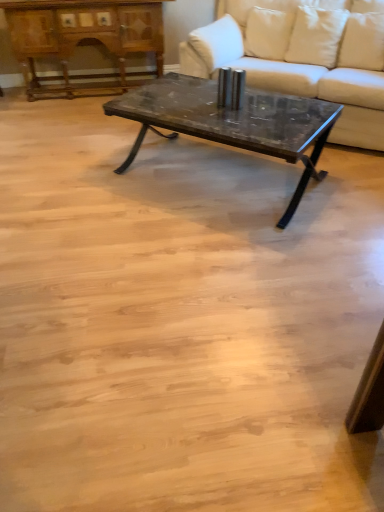
Measure the distance between white fabric pillow at upper right, the first pillow when ordered from left to right, and camera.

The depth of white fabric pillow at upper right, the first pillow when ordered from left to right, is 3.03 meters.

In order to face white fabric pillow at upper center, which is the first pillow in right-to-left order, should I rotate leftwards or rightwards?

It's best to rotate right around 10.186 degrees.

At what (x,y) coordinates should I click in order to perform the action: click on dark gray stone coffee table at center. Please return your answer as a coordinate pair (x, y). Image resolution: width=384 pixels, height=512 pixels. Looking at the image, I should click on (232, 122).

Where is `white fabric pillow at upper right, marked as the second pillow in a right-to-left arrangement`? Image resolution: width=384 pixels, height=512 pixels. white fabric pillow at upper right, marked as the second pillow in a right-to-left arrangement is located at coordinates (218, 42).

What's the angular difference between dark gray stone coffee table at center and white fabric couch at center's facing directions?

4.72 degrees.

Is dark gray stone coffee table at center thinner than white fabric couch at center?

Yes, dark gray stone coffee table at center is thinner than white fabric couch at center.

Between dark gray stone coffee table at center and white fabric couch at center, which one appears on the right side from the viewer's perspective?

white fabric couch at center is more to the right.

Which point is more forward, (326, 117) or (253, 11)?

Point (326, 117)

Is dark gray stone coffee table at center facing away from wooden polished dresser at upper left?

No, dark gray stone coffee table at center is not facing away from wooden polished dresser at upper left.

Can you tell me how much dark gray stone coffee table at center and wooden polished dresser at upper left differ in facing direction?

The facing directions of dark gray stone coffee table at center and wooden polished dresser at upper left are 40.7 degrees apart.

Between dark gray stone coffee table at center and wooden polished dresser at upper left, which one appears on the right side from the viewer's perspective?

dark gray stone coffee table at center is more to the right.

Considering the sizes of objects dark gray stone coffee table at center and wooden polished dresser at upper left in the image provided, who is wider, dark gray stone coffee table at center or wooden polished dresser at upper left?

With larger width is dark gray stone coffee table at center.

Find the location of a particular element. This screenshot has width=384, height=512. studio couch in front of the white fabric pillow at upper right, marked as the second pillow in a right-to-left arrangement is located at coordinates (301, 59).

In the scene shown: From a real-world perspective, does white fabric pillow at upper right, the first pillow when ordered from left to right, stand above white fabric couch at center?

Yes, from a real-world perspective, white fabric pillow at upper right, the first pillow when ordered from left to right, is over white fabric couch at center

Is white fabric couch at center to the right of white fabric pillow at upper right, marked as the second pillow in a right-to-left arrangement, from the viewer's perspective?

Yes.

Between white fabric couch at center and white fabric pillow at upper right, the first pillow when ordered from left to right, which one is positioned behind?

Positioned behind is white fabric pillow at upper right, the first pillow when ordered from left to right.

Measure the distance from white fabric couch at center to white fabric pillow at upper right, the first pillow when ordered from left to right.

white fabric couch at center is 12.93 inches from white fabric pillow at upper right, the first pillow when ordered from left to right.

Considering the sizes of white fabric couch at center and white fabric pillow at upper right, marked as the second pillow in a right-to-left arrangement, in the image, is white fabric couch at center taller or shorter than white fabric pillow at upper right, marked as the second pillow in a right-to-left arrangement,?

Clearly, white fabric couch at center is taller compared to white fabric pillow at upper right, marked as the second pillow in a right-to-left arrangement.

From the image's perspective, is white fabric pillow at upper center, which is the first pillow in right-to-left order, on white fabric pillow at upper right, marked as the second pillow in a right-to-left arrangement?

Yes.

Does white fabric pillow at upper center, which is the first pillow in right-to-left order, have a greater height compared to white fabric pillow at upper right, the first pillow when ordered from left to right?

Yes, white fabric pillow at upper center, which is the first pillow in right-to-left order, is taller than white fabric pillow at upper right, the first pillow when ordered from left to right.

Is white fabric pillow at upper center, the 2th pillow viewed from the left, not close to white fabric pillow at upper right, the first pillow when ordered from left to right?

They are positioned close to each other.

Is point (257, 54) closer or farther from the camera than point (229, 60)?

Point (257, 54) is farther from the camera than point (229, 60).

Is point (111, 13) closer or farther from the camera than point (303, 112)?

Point (111, 13) is positioned farther from the camera compared to point (303, 112).

From a real-world perspective, between wooden polished dresser at upper left and dark gray stone coffee table at center, who is vertically lower?

dark gray stone coffee table at center is physically lower.

Would you say wooden polished dresser at upper left is outside dark gray stone coffee table at center?

Yes, wooden polished dresser at upper left is not within dark gray stone coffee table at center.

Looking at this image, between wooden polished dresser at upper left and dark gray stone coffee table at center, which one is positioned behind?

wooden polished dresser at upper left.

In the image, is wooden polished dresser at upper left positioned in front of or behind white fabric pillow at upper center, the 2th pillow viewed from the left?

Visually, wooden polished dresser at upper left is located behind white fabric pillow at upper center, the 2th pillow viewed from the left.

Consider the image. Who is bigger, wooden polished dresser at upper left or white fabric pillow at upper center, which is the first pillow in right-to-left order?

Bigger between the two is wooden polished dresser at upper left.

Choose the correct answer: Is wooden polished dresser at upper left inside white fabric pillow at upper center, which is the first pillow in right-to-left order, or outside it?

wooden polished dresser at upper left exists outside the volume of white fabric pillow at upper center, which is the first pillow in right-to-left order.

Find the location of a particular element. studio couch on the right side of dark gray stone coffee table at center is located at coordinates (301, 59).

Where is `coffee table located underneath the wooden polished dresser at upper left (from a real-world perspective)`? This screenshot has width=384, height=512. coffee table located underneath the wooden polished dresser at upper left (from a real-world perspective) is located at coordinates (232, 122).

Based on their spatial positions, is white fabric pillow at upper center, which is the first pillow in right-to-left order, or white fabric pillow at upper right, marked as the second pillow in a right-to-left arrangement, further from wooden polished dresser at upper left?

white fabric pillow at upper center, which is the first pillow in right-to-left order, is positioned further to the anchor wooden polished dresser at upper left.

Looking at the image, which one is located further to white fabric pillow at upper center, which is the first pillow in right-to-left order, wooden polished dresser at upper left or white fabric couch at center?

wooden polished dresser at upper left is positioned further to the anchor white fabric pillow at upper center, which is the first pillow in right-to-left order.

Looking at the image, which one is located further to white fabric pillow at upper right, the first pillow when ordered from left to right, white fabric pillow at upper center, which is the first pillow in right-to-left order, or dark gray stone coffee table at center?

The object further to white fabric pillow at upper right, the first pillow when ordered from left to right, is dark gray stone coffee table at center.

Based on the photo, from the image, which object appears to be farther from white fabric pillow at upper right, the first pillow when ordered from left to right, white fabric couch at center or dark gray stone coffee table at center?

dark gray stone coffee table at center is further to white fabric pillow at upper right, the first pillow when ordered from left to right.

Based on their spatial positions, is white fabric pillow at upper right, the first pillow when ordered from left to right, or wooden polished dresser at upper left further from dark gray stone coffee table at center?

wooden polished dresser at upper left is positioned further to the anchor dark gray stone coffee table at center.

Looking at the image, which one is located further to wooden polished dresser at upper left, white fabric couch at center or white fabric pillow at upper right, the first pillow when ordered from left to right?

Among the two, white fabric couch at center is located further to wooden polished dresser at upper left.

Estimate the real-world distances between objects in this image. Which object is closer to dark gray stone coffee table at center, white fabric pillow at upper center, the 2th pillow viewed from the left, or white fabric pillow at upper right, marked as the second pillow in a right-to-left arrangement?

white fabric pillow at upper right, marked as the second pillow in a right-to-left arrangement, lies closer to dark gray stone coffee table at center than the other object.

Looking at the image, which one is located further to white fabric pillow at upper center, the 2th pillow viewed from the left, wooden polished dresser at upper left or white fabric pillow at upper right, the first pillow when ordered from left to right?

wooden polished dresser at upper left.

Where is `pillow between white fabric pillow at upper center, which is the first pillow in right-to-left order, and dark gray stone coffee table at center, in the vertical direction`? The image size is (384, 512). pillow between white fabric pillow at upper center, which is the first pillow in right-to-left order, and dark gray stone coffee table at center, in the vertical direction is located at coordinates (218, 42).

Find the location of a particular element. This screenshot has height=512, width=384. coffee table situated between wooden polished dresser at upper left and white fabric pillow at upper center, which is the first pillow in right-to-left order, from left to right is located at coordinates (232, 122).

The height and width of the screenshot is (512, 384). I want to click on pillow located between wooden polished dresser at upper left and white fabric pillow at upper center, the 2th pillow viewed from the left, in the left-right direction, so click(218, 42).

This screenshot has height=512, width=384. I want to click on coffee table between wooden polished dresser at upper left and white fabric couch at center, so click(x=232, y=122).